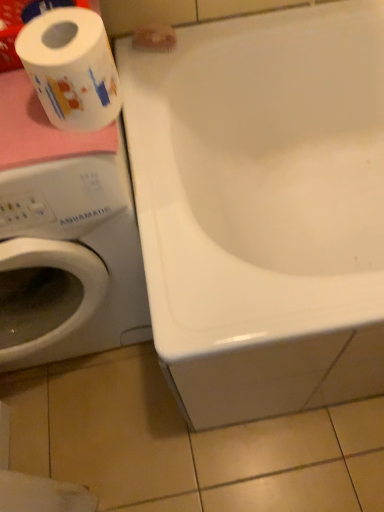
The width and height of the screenshot is (384, 512). I want to click on unoccupied area in front of white matte toilet paper at upper center, the 1th toilet paper from the top, so click(x=157, y=91).